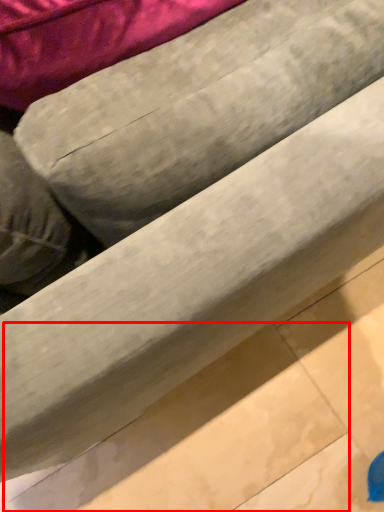
Question: From the image, what is the correct spatial relationship of tile (annotated by the red box) in relation to bean bag chair?

Choices:
 (A) left
 (B) right

Answer: (B)